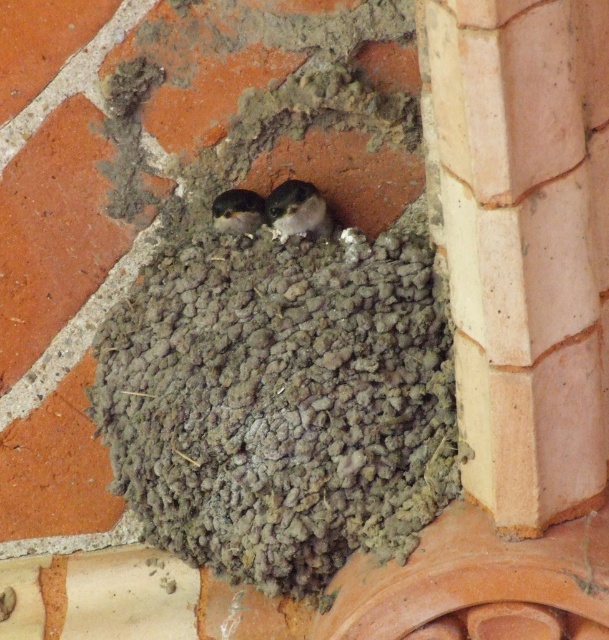
Does white fluffy bird at center have a larger size compared to dark gray feathers at center?

Indeed, white fluffy bird at center has a larger size compared to dark gray feathers at center.

Does white fluffy bird at center have a greater width compared to dark gray feathers at center?

Yes.

You are a GUI agent. You are given a task and a screenshot of the screen. Output one action in this format:
    pyautogui.click(x=<x>, y=<y>)
    Task: Click on the white fluffy bird at center
    Image resolution: width=609 pixels, height=640 pixels.
    Given the screenshot: What is the action you would take?
    pyautogui.click(x=297, y=211)

How far apart are pink clay pillar at upper right and white fluffy bird at center?

A distance of 22.00 inches exists between pink clay pillar at upper right and white fluffy bird at center.

Who is lower down, pink clay pillar at upper right or white fluffy bird at center?

Positioned lower is pink clay pillar at upper right.

Between point (585, 364) and point (286, 230), which one is positioned behind?

The point (286, 230) is behind.

Where is `pink clay pillar at upper right`? pink clay pillar at upper right is located at coordinates (526, 246).

Does pink clay pillar at upper right appear over dark gray feathers at center?

No.

Based on the photo, between pink clay pillar at upper right and dark gray feathers at center, which one appears on the right side from the viewer's perspective?

pink clay pillar at upper right is more to the right.

Does point (519, 458) come farther from viewer compared to point (258, 200)?

No, (519, 458) is in front of (258, 200).

I want to click on pink clay pillar at upper right, so click(x=526, y=246).